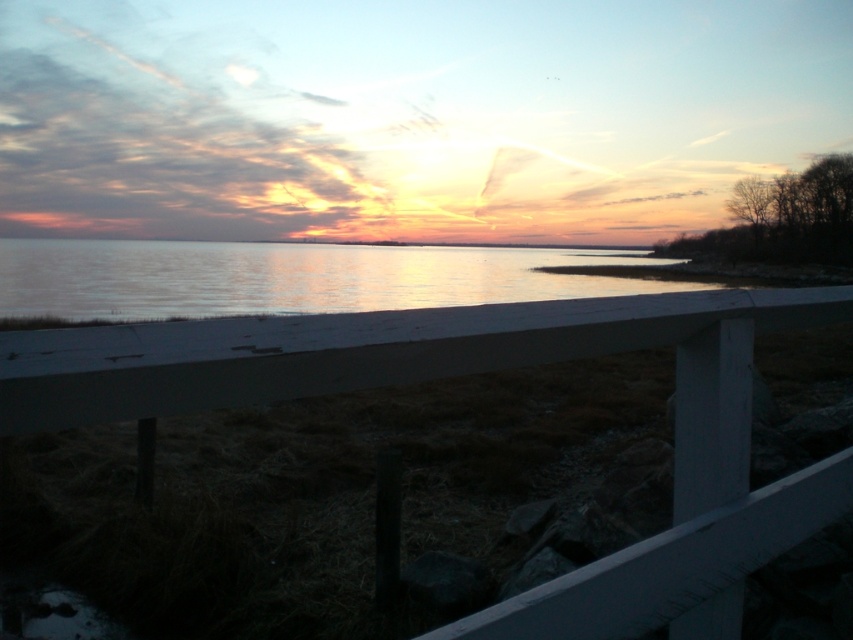
You are standing behind the white painted wood rail at upper center and looking out at the smooth water at center. Which object is positioned to the right when viewed from your perspective?

The white painted wood rail at upper center is to the right of the smooth water at center, so when you are standing behind the white painted wood rail at upper center and looking towards the smooth water at center, the white painted wood rail at upper center is positioned to the right of the smooth water at center.

You are standing behind the white painted wood rail at upper center and want to look at the smooth water at center. Which direction should you look in relation to the rail?

The white painted wood rail at upper center is located below the smooth water at center, so you should look upward to see the smooth water at center above the rail.

You are standing behind the white wooden railing and want to take a photo of the sunset. There are two points in the scene marked as point 1 at coordinates (566,326) and point 2 at coordinates (15,266). Which point is closer to you when considering the railing as the foreground?

Point 1 at coordinates (566,326) is in front of point 2 at coordinates (15,266), so point 1 is closer to you.